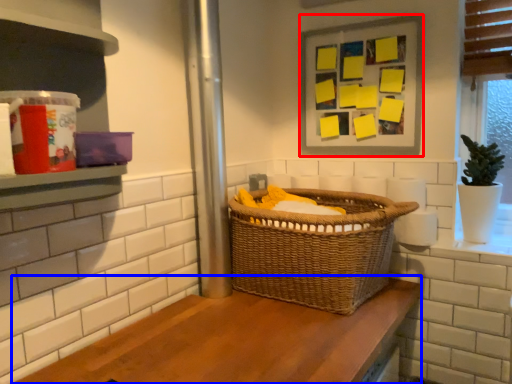
Question: Which object is further to the camera taking this photo, picture frame (highlighted by a red box) or counter (highlighted by a blue box)?

Choices:
 (A) picture frame
 (B) counter

Answer: (A)